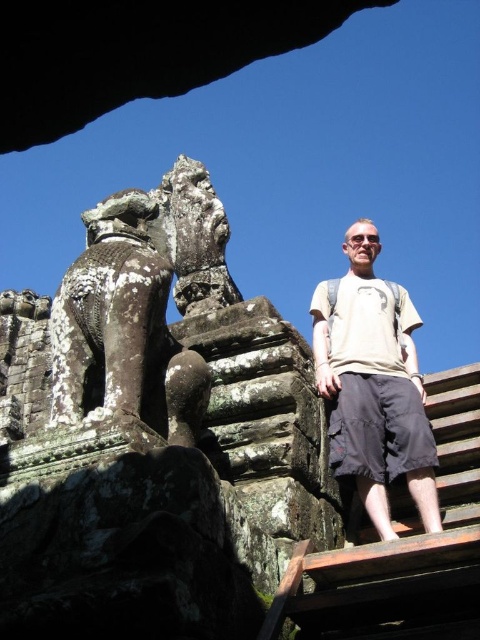
Is wooden stairs at center bigger than weathered stone statue at upper center?

Indeed, wooden stairs at center has a larger size compared to weathered stone statue at upper center.

Is point (405, 572) in front of point (201, 234)?

Yes, point (405, 572) is in front of point (201, 234).

Is point (371, 561) closer to viewer compared to point (187, 234)?

Yes, it is.

At what (x,y) coordinates should I click in order to perform the action: click on wooden stairs at center. Please return your answer as a coordinate pair (x, y). Looking at the image, I should click on (402, 548).

Who is more forward, (330, 570) or (417, 413)?

Positioned in front is point (330, 570).

Does wooden stairs at center have a greater height compared to beige cotton t-shirt at center?

No.

Is point (468, 525) closer to viewer compared to point (347, 419)?

Yes, point (468, 525) is closer to viewer.

What are the coordinates of `wooden stairs at center` in the screenshot? It's located at (402, 548).

Does point (333, 433) lie in front of point (226, 227)?

Yes, point (333, 433) is in front of point (226, 227).

The image size is (480, 640). What do you see at coordinates (373, 387) in the screenshot?
I see `beige cotton t-shirt at center` at bounding box center [373, 387].

This screenshot has width=480, height=640. In order to click on beige cotton t-shirt at center in this screenshot , I will do `click(373, 387)`.